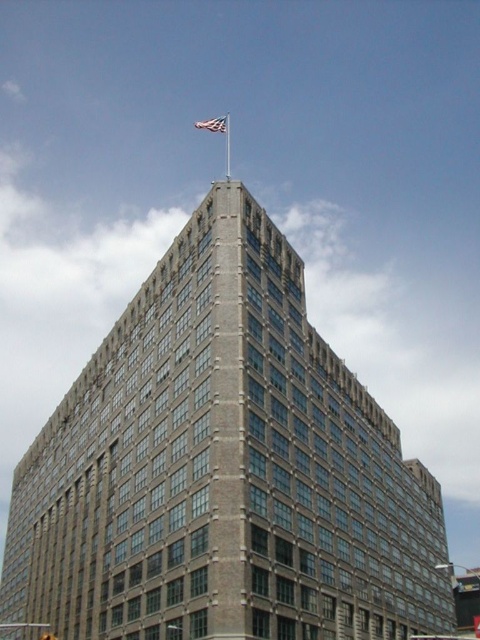
You are standing in front of the building and notice two points marked on the facade. The first point is at coordinates point (219, 124) and the second is at point (227, 145). Which of these two points is closer to you?

Point (219, 124) is in front of point (227, 145), so it is closer to you.

You are a window washer working on the building. You need to reach the white fabric flag at top and the silver metallic flag pole at upper center. Which object is higher up?

The white fabric flag at top is above the silver metallic flag pole at upper center, so it is higher up.

You are an architect reviewing the building design. You notice the white fabric flag at top and the silver metallic flag pole at upper center. Which object is closer to the left edge of the building?

The white fabric flag at top is closer to the left edge of the building because it is positioned on the left side of the silver metallic flag pole at upper center.